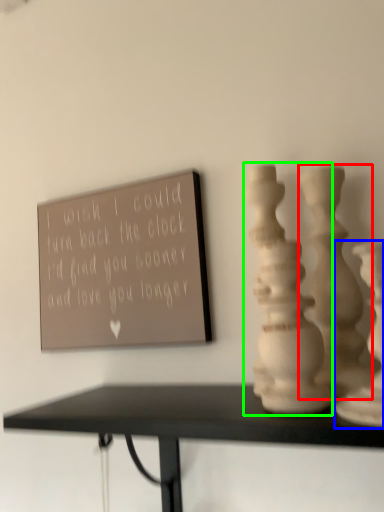
Question: Based on their relative distances, which object is farther from vase (highlighted by a red box)? Choose from vase (highlighted by a blue box) and vase (highlighted by a green box).

Choices:
 (A) vase
 (B) vase

Answer: (A)